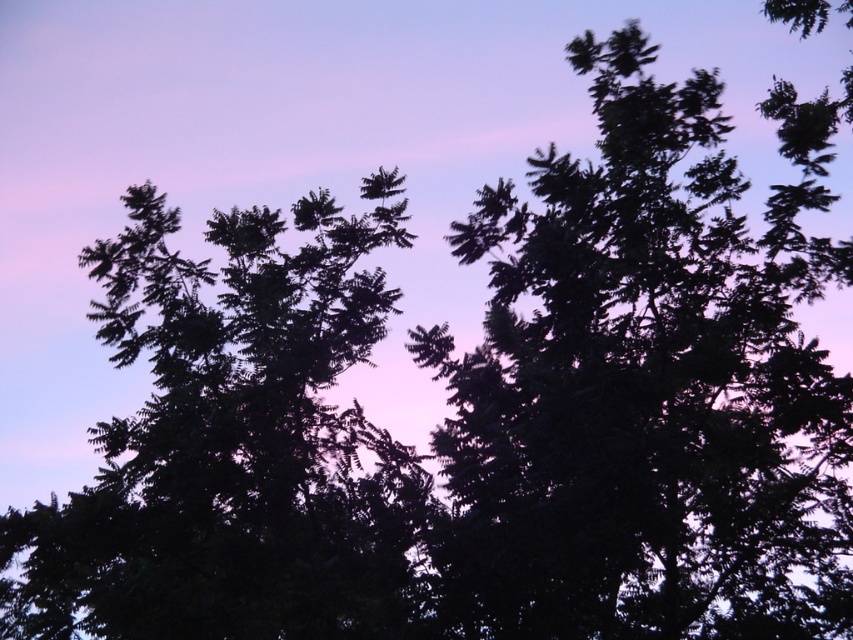
Between point (479, 536) and point (157, 262), which one is positioned behind?

Positioned behind is point (157, 262).

Is dark green foliage at center further to camera compared to dark green leafy tree at upper left?

No, dark green foliage at center is in front of dark green leafy tree at upper left.

The height and width of the screenshot is (640, 853). What are the coordinates of `dark green foliage at center` in the screenshot? It's located at (647, 387).